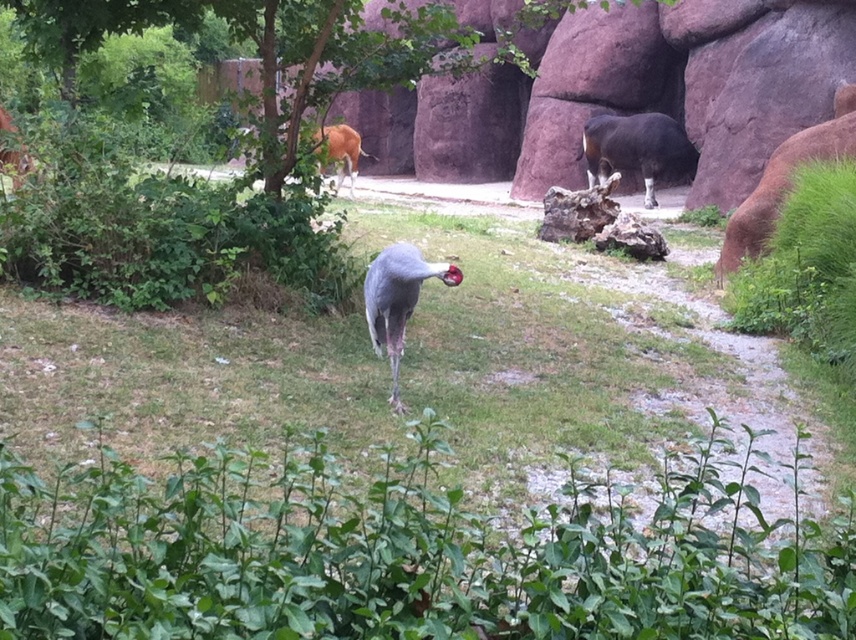
You are a zookeeper planning to install a new fence around the upper center area. The fence needs to be tall enough to contain the brown glossy antelope at upper center but not block the view of the green leafy tree at upper center. What should be the minimum height of the fence?

The green leafy tree at upper center is taller than the brown glossy antelope at upper center. Therefore, the fence should be set at a height that is taller than the brown glossy antelope at upper center but shorter than the green leafy tree at upper center to both contain the antelope and allow the tree to be visible.

You are a zookeeper planning to place a new feeding station between the green leafy tree at upper center and the brown glossy antelope at upper center. What is the minimum distance you need to cover to position it exactly halfway between them?

The green leafy tree at upper center and brown glossy antelope at upper center are 3.45 meters apart. To place the feeding station halfway, the minimum distance to cover from either object would be half of 3.45 meters, which is approximately 1.725 meters.

You are standing at the point labeled point (x=635, y=148) in the image. Which animal are you touching?

The point labeled point (x=635, y=148) is on the shiny black cow at center, so you are touching the shiny black cow at center.